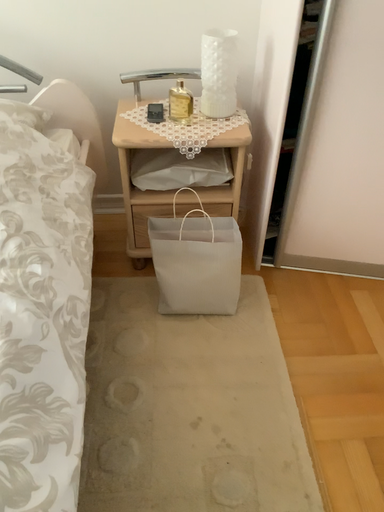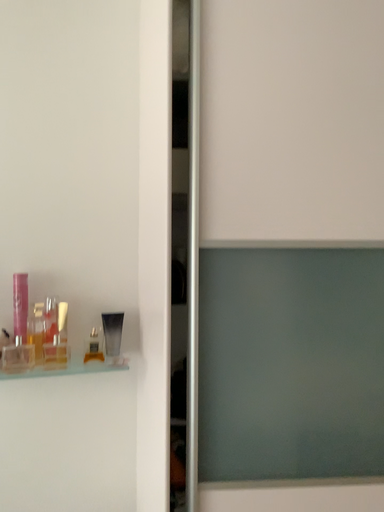
Question: Which way did the camera rotate in the video?

Choices:
 (A) rotated left
 (B) rotated right

Answer: (B)